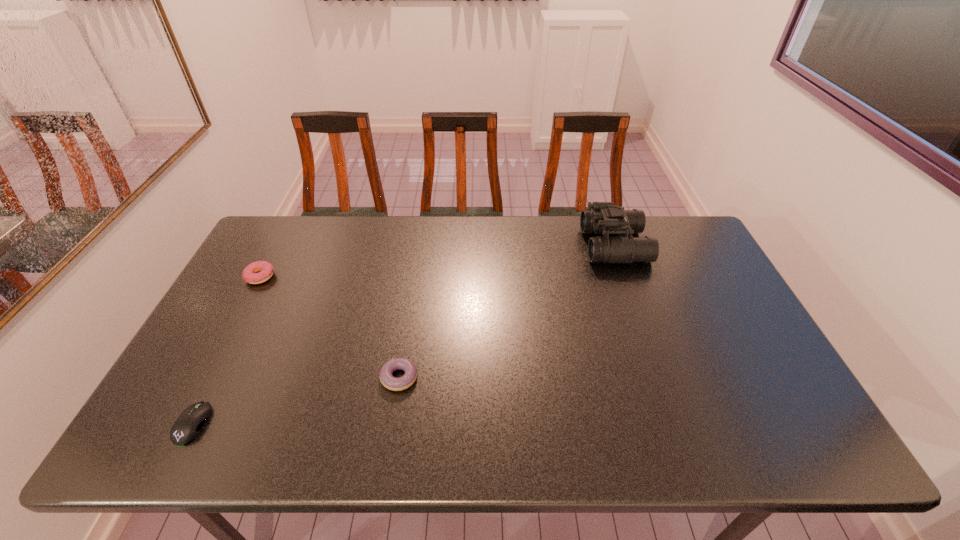
Where is `free space at the far left corner`? The height and width of the screenshot is (540, 960). free space at the far left corner is located at coordinates (300, 237).

In the image, there is a desktop. Where is `vacant space at the far right corner`? The width and height of the screenshot is (960, 540). vacant space at the far right corner is located at coordinates (688, 254).

Image resolution: width=960 pixels, height=540 pixels. In order to click on free space between the farther doughnut and the right doughnut in this screenshot , I will do `click(329, 327)`.

This screenshot has width=960, height=540. Find the location of `free spot between the rightmost object and the nearest object`. free spot between the rightmost object and the nearest object is located at coordinates (404, 334).

Where is `vacant space that's between the farther doughnut and the nearest object`? Image resolution: width=960 pixels, height=540 pixels. vacant space that's between the farther doughnut and the nearest object is located at coordinates (227, 350).

Where is `vacant area that lies between the tallest object and the nearer doughnut`? vacant area that lies between the tallest object and the nearer doughnut is located at coordinates (507, 312).

Where is `vacant area that lies between the computer equipment and the tallest object`? The width and height of the screenshot is (960, 540). vacant area that lies between the computer equipment and the tallest object is located at coordinates (404, 334).

Identify the location of empty space that is in between the left doughnut and the tallest object. The image size is (960, 540). tap(437, 261).

I want to click on free spot between the second nearest object and the tallest object, so click(507, 312).

Where is `empty location between the second nearest object and the computer equipment`? empty location between the second nearest object and the computer equipment is located at coordinates (297, 401).